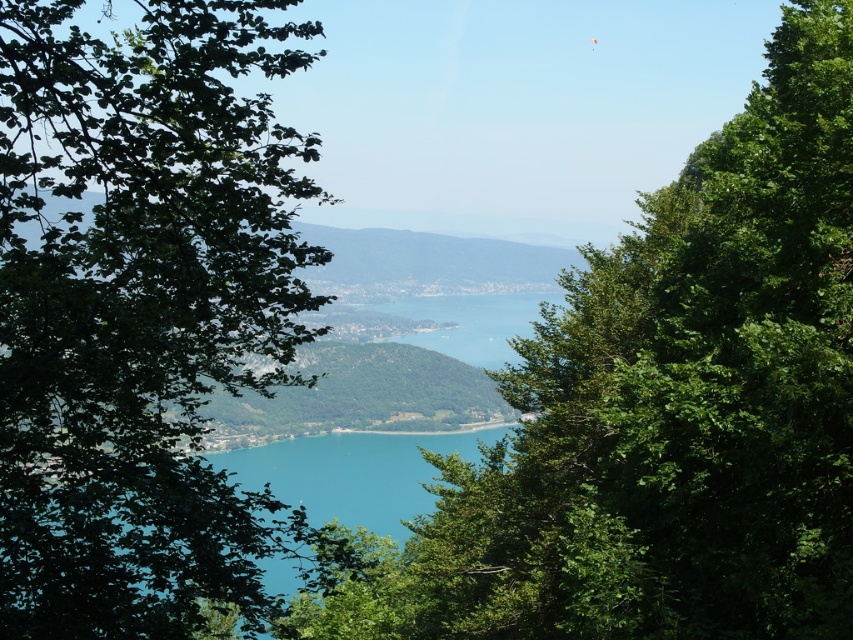
You are a photographer planning to capture the entire scene in one shot. Given that the green leafy hill at center and the turquoise water at center are both in the frame, which object would appear bigger in your photo?

The green leafy hill at center would appear bigger in the photo since it has a larger size compared to the turquoise water at center according to the description.

Consider the image. You are an artist trying to paint this landscape. You have to decide which object to paint first based on their sizes. Which one should you start with, the green leafy tree at left or the green leafy hill at center?

The green leafy tree at left is larger in size than the green leafy hill at center, so you should start painting the green leafy tree at left first because it requires more attention due to its larger size.